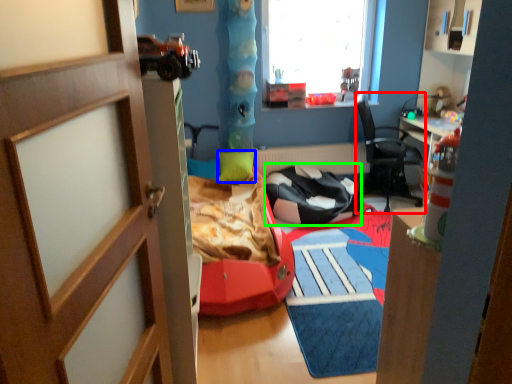
Question: Which is farther away from chair (highlighted by a red box)? pillow (highlighted by a blue box) or chair (highlighted by a green box)?

Choices:
 (A) pillow
 (B) chair

Answer: (A)